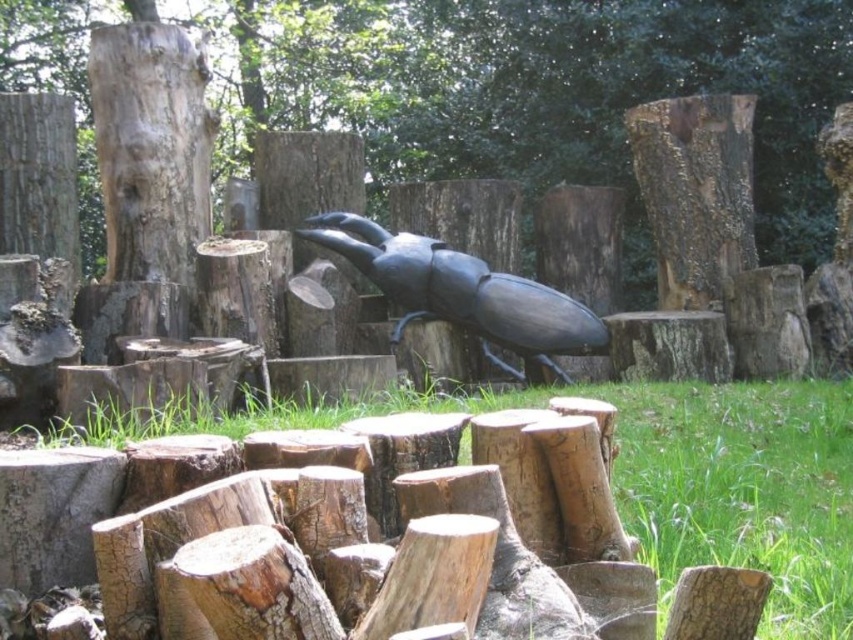
You are an artist planning to paint a scene from the forest. You want to position your easel so that both the smooth brown tree trunk at upper left and the black matte beetle at center are visible in your painting. Based on their positions, which object should you place on the left side of your canvas?

The smooth brown tree trunk at upper left is positioned to the left of the black matte beetle at center, so you should place the smooth brown tree trunk at upper left on the left side of your canvas.